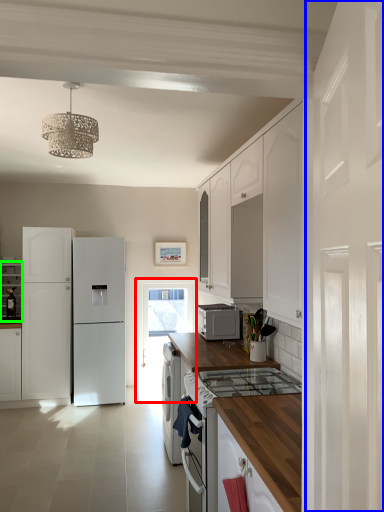
Question: Which object is the farthest from glass door (highlighted by a red box)? Choose among these: side (highlighted by a blue box) or cabinetry (highlighted by a green box).

Choices:
 (A) side
 (B) cabinetry

Answer: (A)